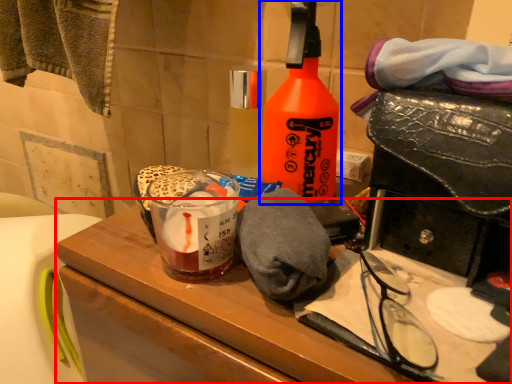
Question: Which object appears closest to the camera in this image, vanity (highlighted by a red box) or bottle (highlighted by a blue box)?

Choices:
 (A) vanity
 (B) bottle

Answer: (A)